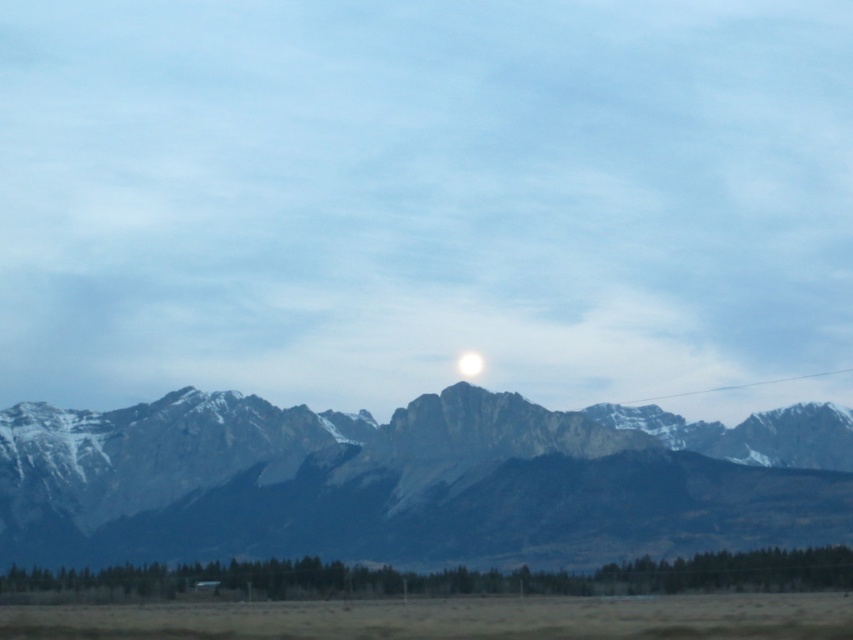
Between clear plastic wire at upper right and white glossy moon at center, which one has less height?

white glossy moon at center is shorter.

Does clear plastic wire at upper right have a greater width compared to white glossy moon at center?

Yes, clear plastic wire at upper right is wider than white glossy moon at center.

Does point (784, 381) come closer to viewer compared to point (465, 358)?

No, it is not.

Find the location of `clear plastic wire at upper right`. clear plastic wire at upper right is located at coordinates (737, 387).

Is point (489, 449) positioned before point (473, 353)?

That is True.

Does gray rocky mountain range at center lie in front of white glossy moon at center?

That is True.

Identify the location of gray rocky mountain range at center. The height and width of the screenshot is (640, 853). pos(383,484).

Is brown grassland at lower center smaller than white glossy moon at center?

No, brown grassland at lower center is not smaller than white glossy moon at center.

Is point (378, 636) positioned after point (474, 365)?

No, (378, 636) is closer to viewer.

At what (x,y) coordinates should I click in order to perform the action: click on brown grassland at lower center. Please return your answer as a coordinate pair (x, y). This screenshot has width=853, height=640. Looking at the image, I should click on (447, 618).